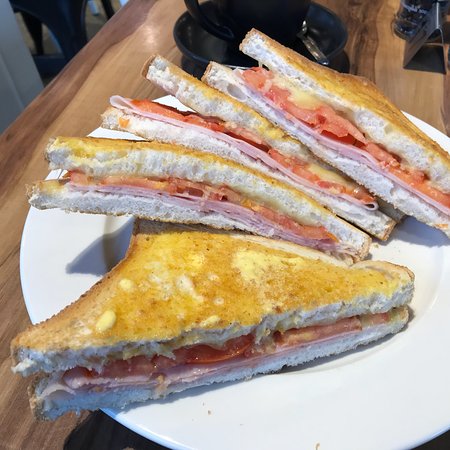
Where is `white porcelain plate`? This screenshot has height=450, width=450. white porcelain plate is located at coordinates (64, 257), (355, 403), (431, 254).